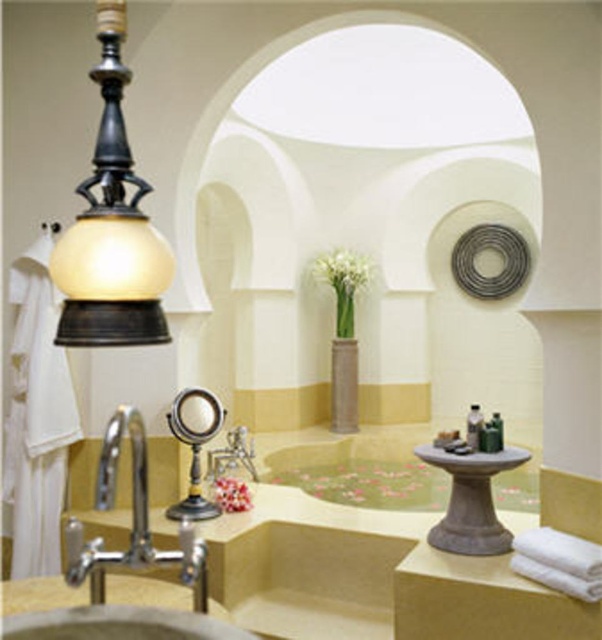
You are standing in the bathroom and want to locate the smooth stone bath at center. According to the scene description, where would you find it?

The smooth stone bath at center is located at the point with coordinates (x=361, y=472).